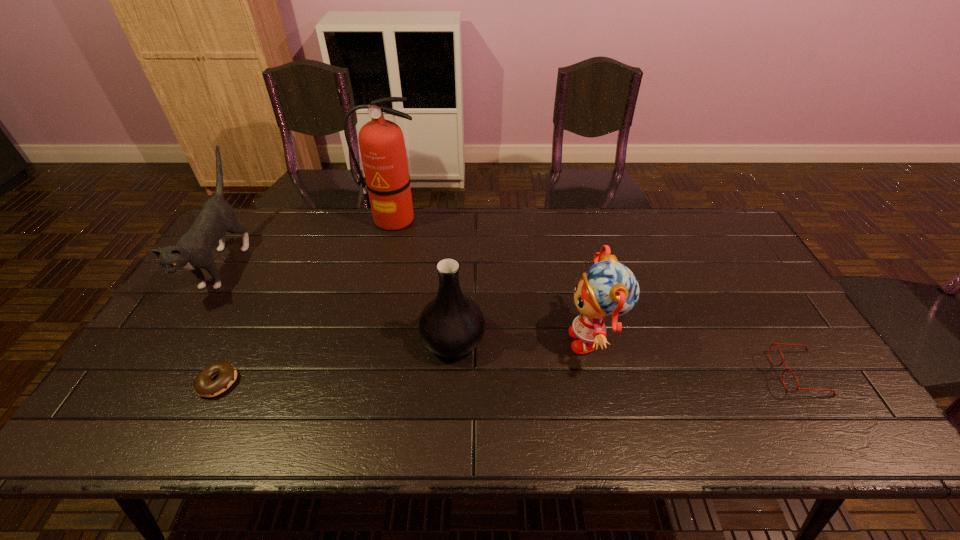
Where is `the third object from left to right`? The width and height of the screenshot is (960, 540). the third object from left to right is located at coordinates (382, 147).

The width and height of the screenshot is (960, 540). In order to click on fire extinguisher in this screenshot , I will do `click(382, 147)`.

Where is `the leftmost object`? This screenshot has height=540, width=960. the leftmost object is located at coordinates (193, 251).

Locate an element on the screen. Image resolution: width=960 pixels, height=540 pixels. the third object from right to left is located at coordinates (451, 325).

Image resolution: width=960 pixels, height=540 pixels. Identify the location of the second object from right to left. (609, 288).

Locate an element on the screen. the rightmost object is located at coordinates (782, 362).

Where is `the second shortest object`? the second shortest object is located at coordinates (782, 362).

Find the location of a particular element. the shortest object is located at coordinates (203, 385).

Locate an element on the screen. The width and height of the screenshot is (960, 540). the fifth object from right to left is located at coordinates (203, 385).

This screenshot has width=960, height=540. Identify the location of vacant area situated on the side of the fire extinguisher with the nozzle and handle. (377, 286).